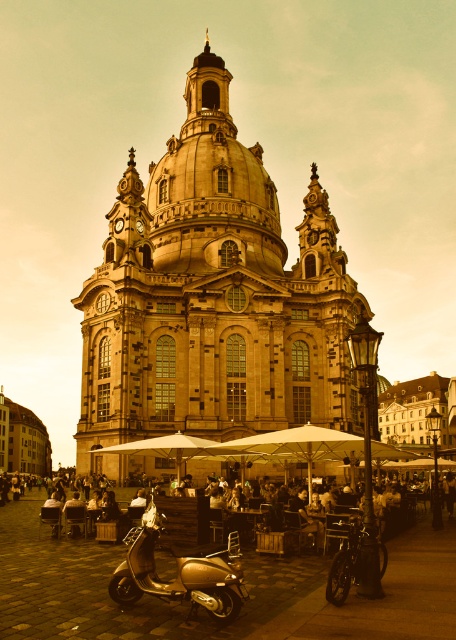
Between golden stone church at center and gold metallic scooter at lower left, which one has more height?

With more height is golden stone church at center.

Can you confirm if golden stone church at center is wider than gold metallic scooter at lower left?

Yes.

Between point (128, 224) and point (340, 566), which one is positioned behind?

The point (128, 224) is behind.

Find the location of `golden stone church at center`. golden stone church at center is located at coordinates (212, 300).

Does golden stone church at center have a smaller size compared to gold metallic scooter at center?

No.

Does golden stone church at center have a greater width compared to gold metallic scooter at center?

Indeed, golden stone church at center has a greater width compared to gold metallic scooter at center.

Is point (188, 81) positioned in front of point (127, 604)?

No, (188, 81) is further to viewer.

Where is `golden stone church at center`? The height and width of the screenshot is (640, 456). golden stone church at center is located at coordinates (212, 300).

Between point (330, 454) and point (412, 518), which one is positioned in front?

Point (330, 454)

Is white fabric umbrella at center below matte black scooter at lower left?

No.

Identify the location of white fabric umbrella at center. (295, 445).